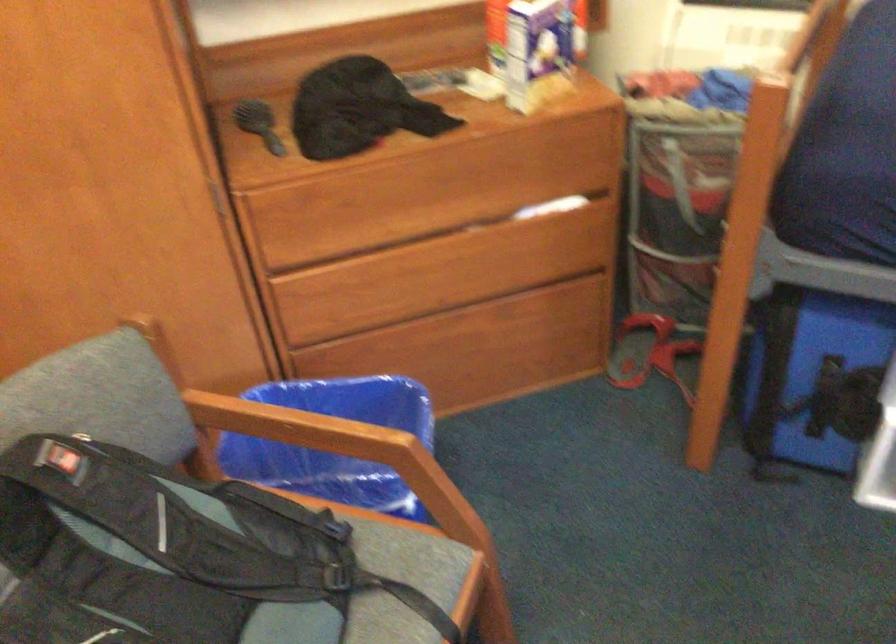
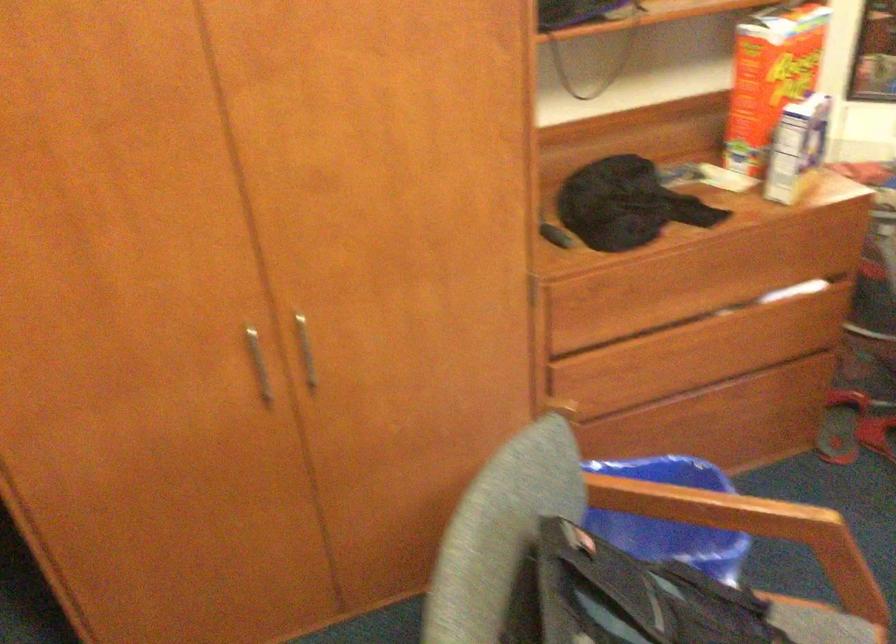
Question: The images are taken continuously from a first-person perspective. In which direction are you moving?

Choices:
 (A) Left
 (B) Right
 (C) Forward
 (D) Backward

Answer: (A)